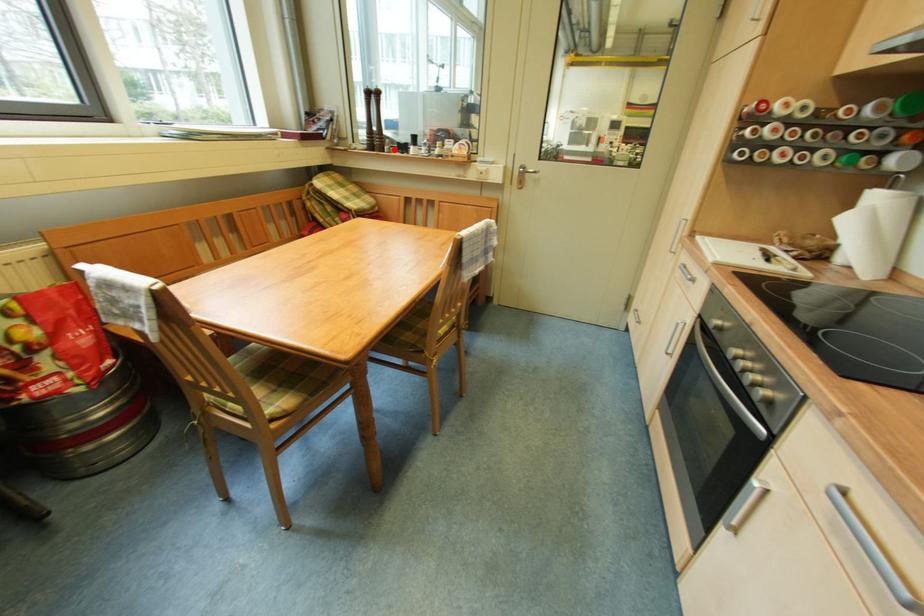
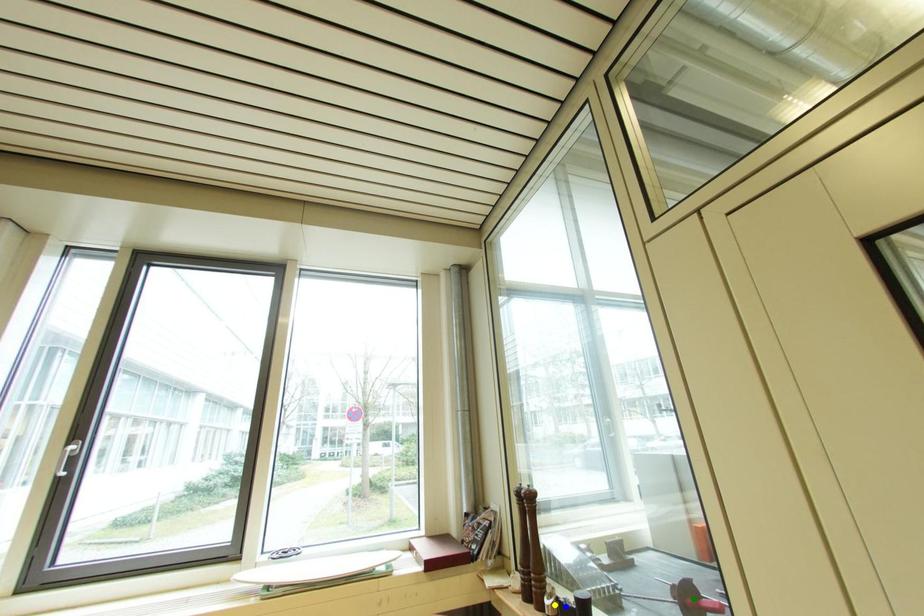
Question: I am providing you with two images of the same scene from different viewpoints. A red point is marked on the first image. You are given multiple points on the second image. Which point in image 2 represents the same 3d spot as the red point in image 1?

Choices:
 (A) yellow point
 (B) blue point
 (C) green point

Answer: (A)